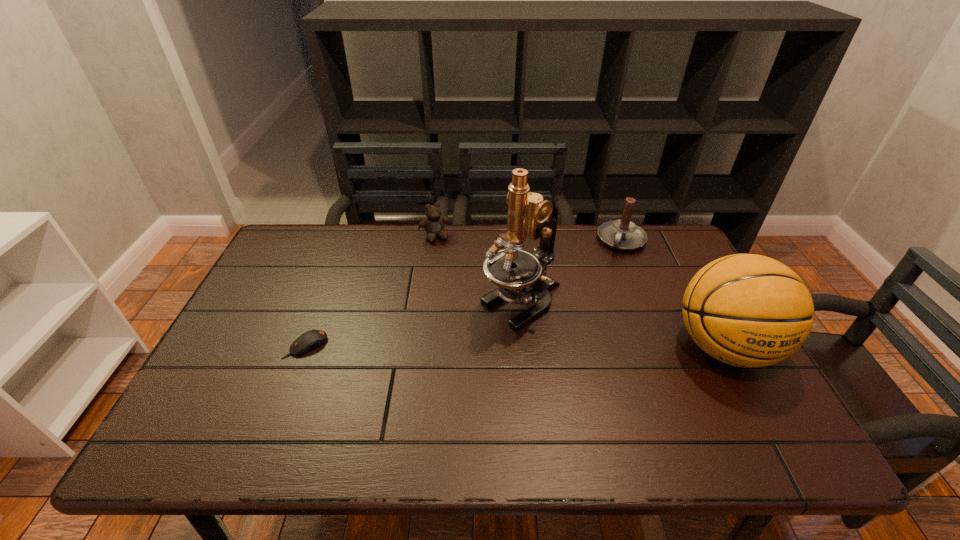
Find the location of a particular element. Image resolution: width=960 pixels, height=540 pixels. free space on the desktop that is between the computer mouse and the basketball and is positioned on the face of the fourth object from right to left is located at coordinates (489, 346).

I want to click on free space on the desktop that is between the computer mouse and the fourth shortest object and is positioned on the side of the third tallest object with the handle loop, so click(x=572, y=347).

Where is `free space on the desktop that is between the computer mouse and the basketball and is positioned at the eyepiece of the microscope`? free space on the desktop that is between the computer mouse and the basketball and is positioned at the eyepiece of the microscope is located at coordinates (455, 346).